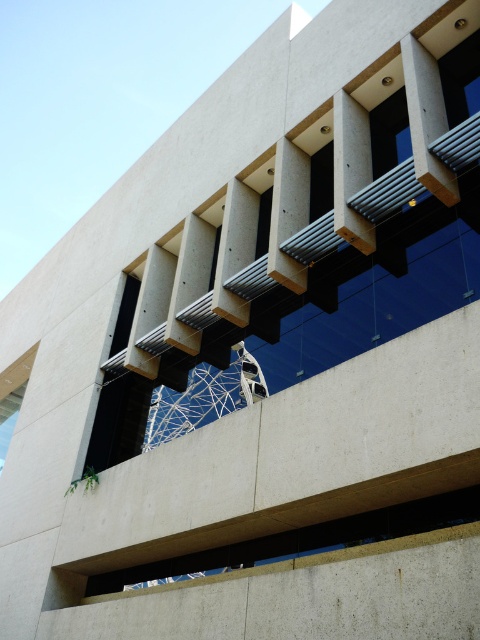
You are an architect analyzing the building facade. You notice two black glass windows, the black glass window at upper left and the black glass window at center. Which one is located more to the left side of the building?

The black glass window at upper left is positioned on the left side of the black glass window at center, so it is more to the left side of the building.

Based on the photo, you are standing at the base of the building looking up. There are two points marked on the facade. The first point is at coordinates point (468, 74) and the second is at point (265, 204). Which point is higher up on the building?

Point (265, 204) is higher up on the building because it has a lower y coordinate value compared to point (468, 74). In coordinate systems, lower y values indicate higher positions when looking upwards from the base.